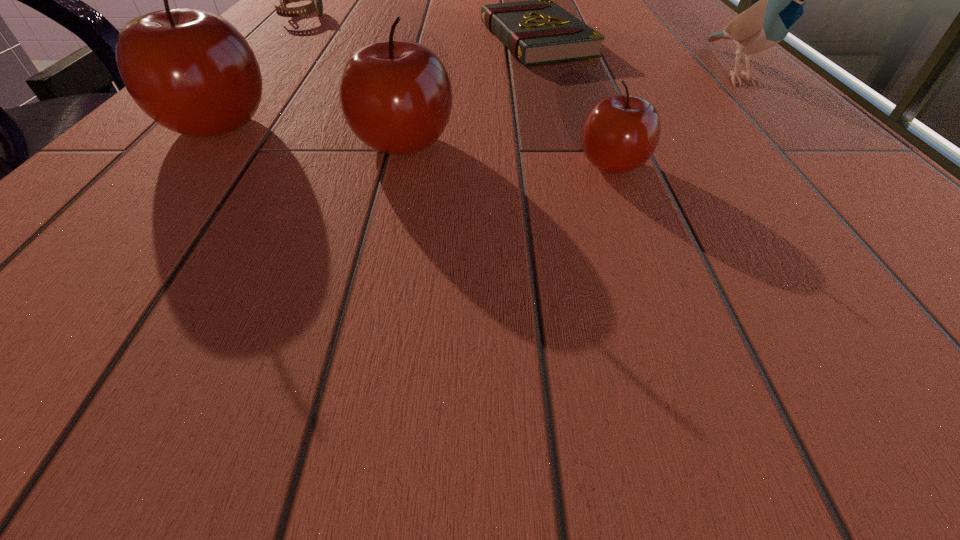
The apples are evenly distributed in the image. To maintain this, where would you place another apple on the right? Please point to a free space. Please provide its 2D coordinates. Your answer should be formatted as a tuple, i.e. [(x, y)], where the tuple contains the x and y coordinates of a point satisfying the conditions above.

[(851, 187)]